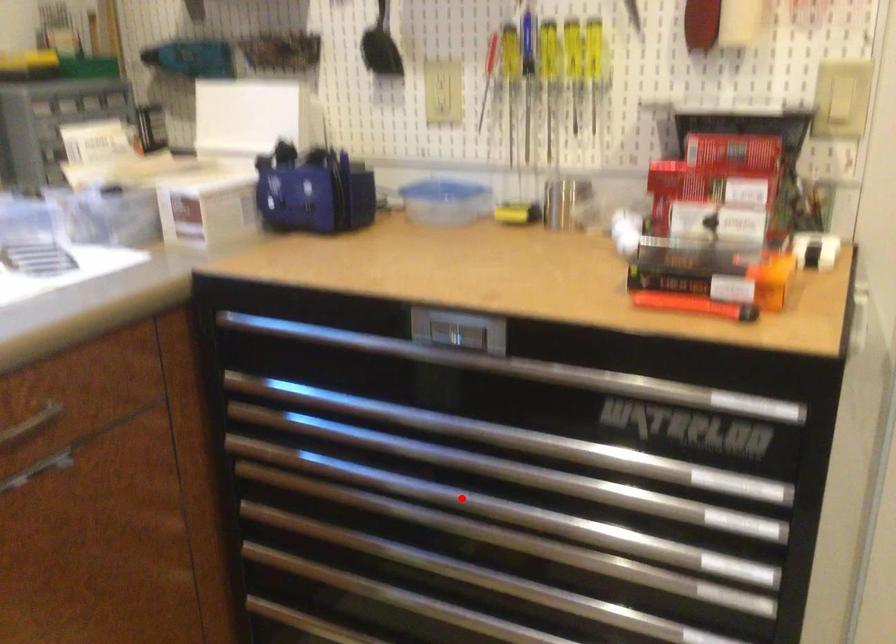
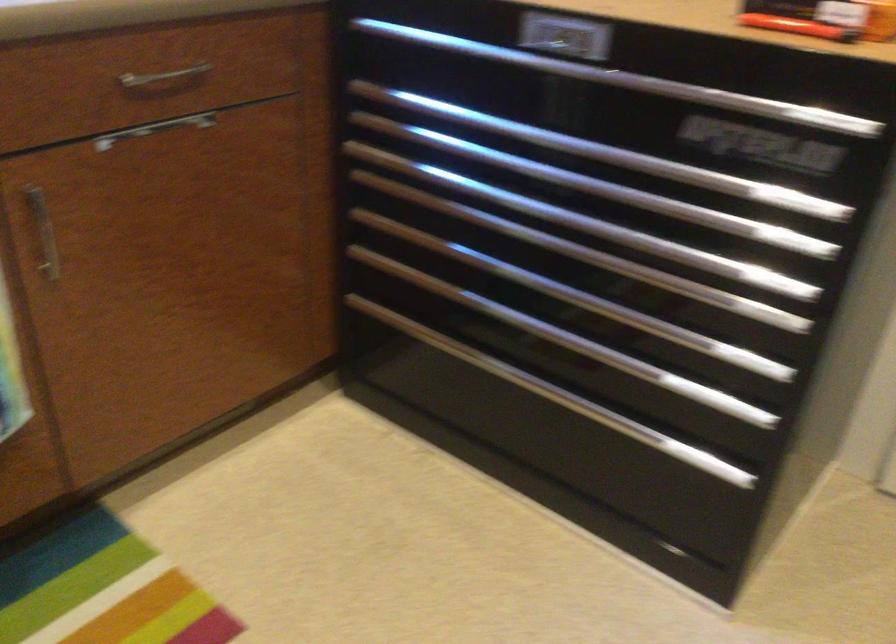
In the second image, find the point that corresponds to the highlighted location in the first image.

(538, 209)